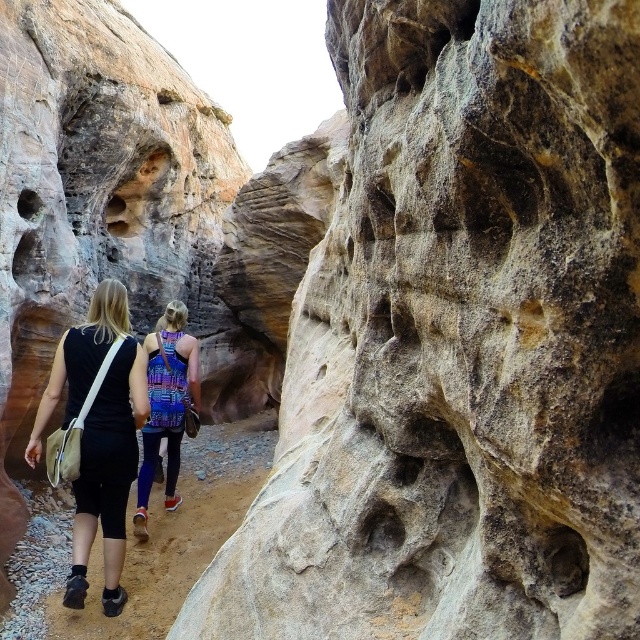
You are a hiker trying to locate your backpack in the canyon. You remember that your backpack is at the center of the image. Based on the coordinates provided, can you confirm if the point at (99,435) corresponds to the center of the image?

The point at (99,435) marks the black fabric bag at center, so yes, this point does correspond to the center of the image where your backpack is located.

You are standing at the point marked by the coordinate point at point (97, 352). You want to reach the exit located at the other end of the canyon. The canyon is 130.18 feet wide. Can you estimate if you can cross the canyon safely?

The canyon is 130.18 feet wide, so you can cross it safely as the distance is manageable for a hiker.

You are a hiker who needs to access your gear quickly. Which item, the black fabric bag at center or the multicolored fabric backpack at center, is easier to reach since it is closer to you?

The black fabric bag at center is in front of the multicolored fabric backpack at center, so it is closer and easier to reach.